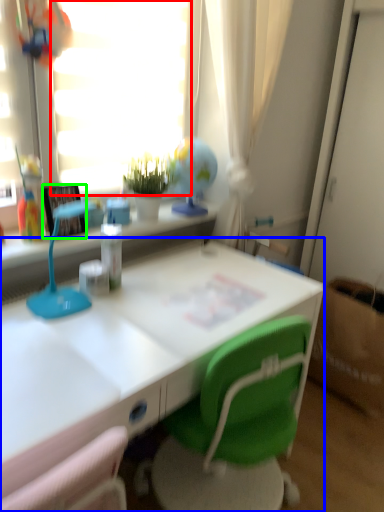
Question: Estimate the real-world distances between objects in this image. Which object is closer to window screen (highlighted by a red box), desk (highlighted by a blue box) or picture frame (highlighted by a green box)?

Choices:
 (A) desk
 (B) picture frame

Answer: (B)